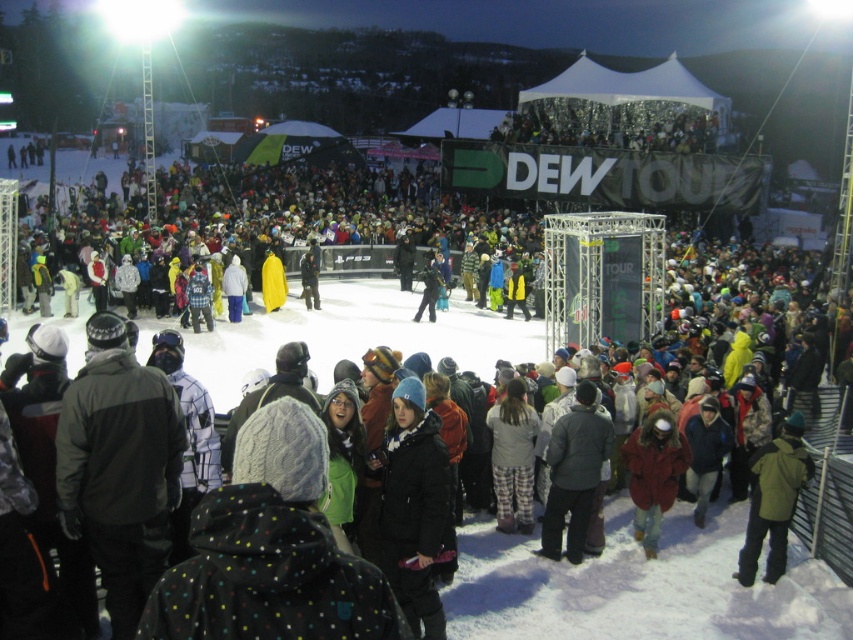
You are a photographer at the event and want to capture a photo that includes both the black matte jacket at center and the green matte jacket at lower right. Which jacket should you focus on first to ensure both are in the frame?

The black matte jacket at center is positioned over the green matte jacket at lower right, so focusing on the black matte jacket at center first will ensure both are in the frame.

Consider the image. You are a photographer at the event and want to capture a photo of the black matte jacket at center. What are the coordinates where you should focus your camera?

The coordinates for the black matte jacket at center are at point [413,508].